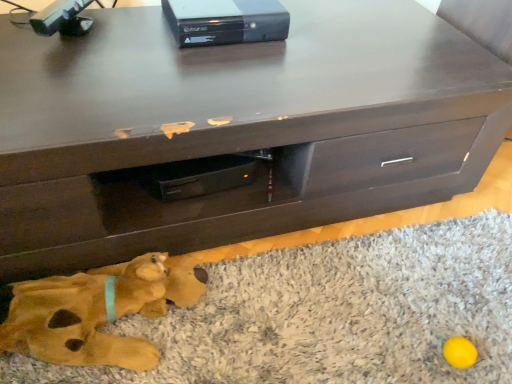
Question: Considering their positions, is dark wood chest of drawers at center located in front of or behind black plastic game console at upper center?

Choices:
 (A) front
 (B) behind

Answer: (A)

Question: Is dark wood chest of drawers at center wider or thinner than black plastic game console at upper center?

Choices:
 (A) thin
 (B) wide

Answer: (B)

Question: Which object is the farthest from the dark wood chest of drawers at center?

Choices:
 (A) soft plush rug at lower center
 (B) soft plush dog at lower left
 (C) black plastic game console at upper center

Answer: (B)

Question: Estimate the real-world distances between objects in this image. Which object is farther from the black plastic game console at upper center?

Choices:
 (A) soft plush rug at lower center
 (B) soft plush dog at lower left
 (C) dark wood chest of drawers at center

Answer: (A)